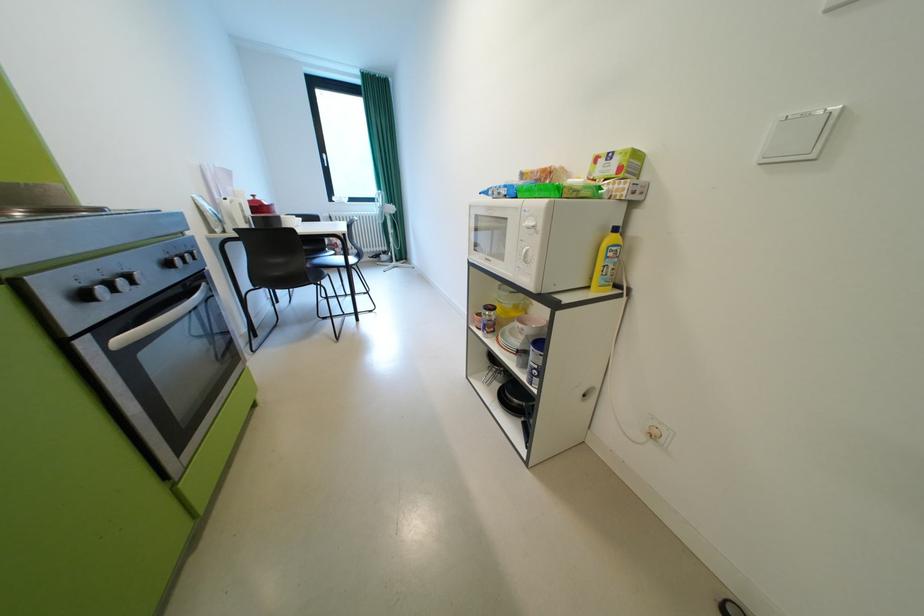
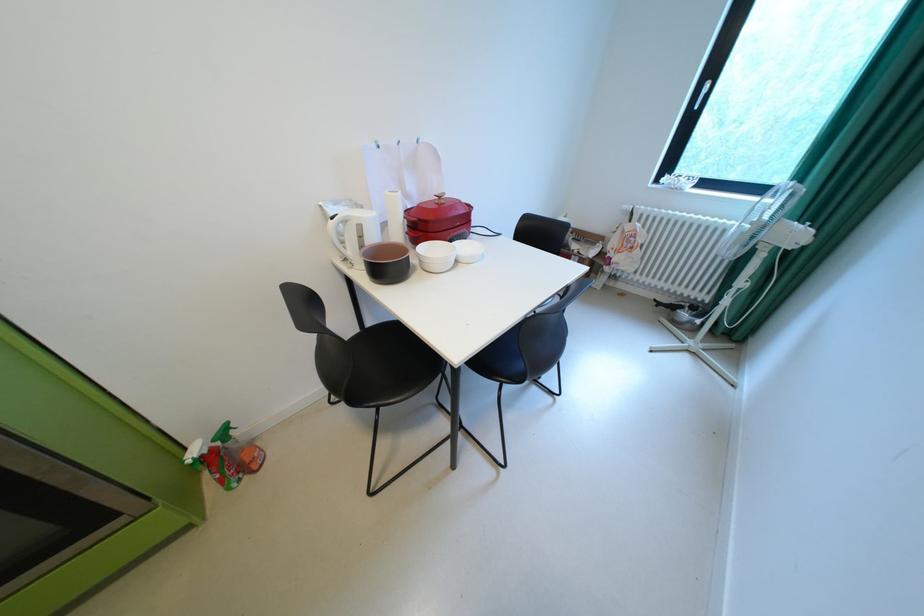
Where in the second image is the point corresponding to (254,217) from the first image?

(371, 246)